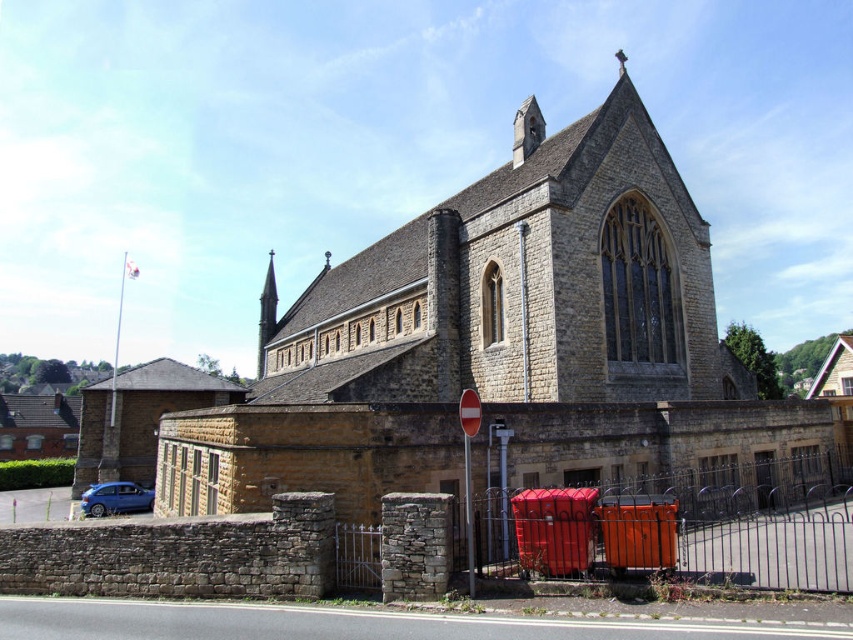
Does point (248, 416) come in front of point (102, 492)?

Yes.

Between stone church at center and metallic blue hatchback at lower left, which one appears on the left side from the viewer's perspective?

Positioned to the left is metallic blue hatchback at lower left.

Is point (283, 451) in front of point (80, 508)?

Yes.

Identify the location of stone church at center. (498, 342).